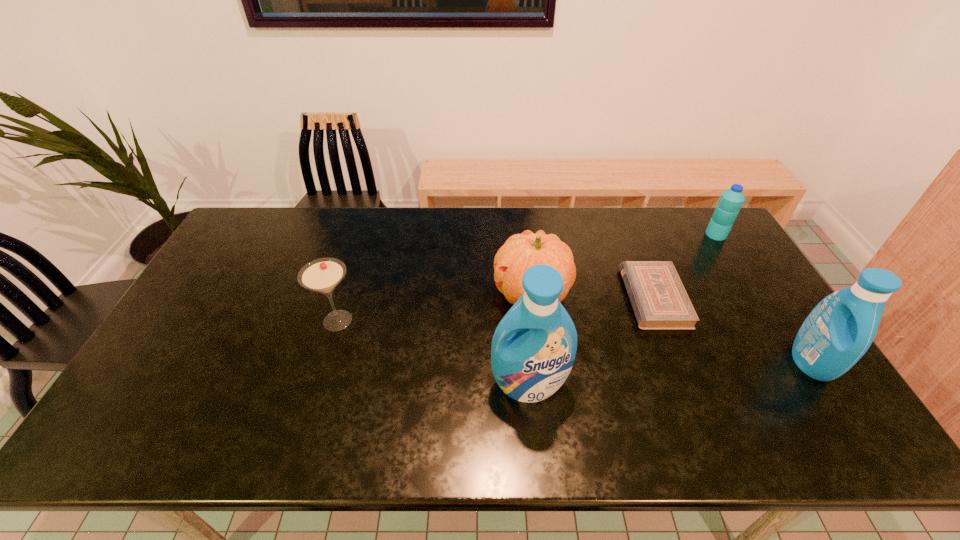
The width and height of the screenshot is (960, 540). I want to click on object that is at the far right corner, so click(x=731, y=200).

The height and width of the screenshot is (540, 960). In order to click on object that is positioned at the near right corner in this screenshot , I will do `click(840, 329)`.

I want to click on vacant area at the far edge of the desktop, so click(507, 207).

Identify the location of free location at the near edge. This screenshot has height=540, width=960. (379, 389).

In the image, there is a desktop. Identify the location of vacant space at the left edge. The image size is (960, 540). (218, 311).

The width and height of the screenshot is (960, 540). I want to click on vacant space at the right edge of the desktop, so click(770, 369).

At what (x,y) coordinates should I click in order to perform the action: click on vacant space at the far left corner of the desktop. Please return your answer as a coordinate pair (x, y). Image resolution: width=960 pixels, height=540 pixels. Looking at the image, I should click on pos(269,245).

This screenshot has height=540, width=960. I want to click on vacant space at the far right corner, so click(x=700, y=225).

Find the location of a particular element. The height and width of the screenshot is (540, 960). unoccupied position between the leftmost object and the fourth shortest object is located at coordinates (435, 307).

Identify the location of free space between the third tallest object and the leftmost object. (435, 307).